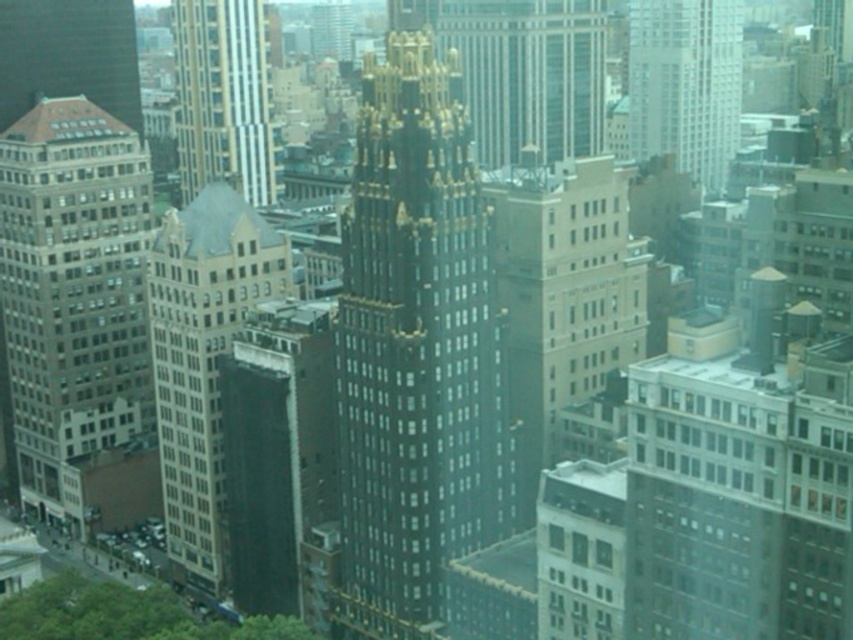
Question: From the image, what is the correct spatial relationship of shiny gold tower at center in relation to beige concrete building at center?

Choices:
 (A) below
 (B) above

Answer: (A)

Question: Among these objects, which one is farthest from the camera?

Choices:
 (A) matte brown building at upper left
 (B) white glass building at upper right

Answer: (B)

Question: Does beige concrete building at center come in front of gold/golden glass tower at upper center?

Choices:
 (A) yes
 (B) no

Answer: (A)

Question: Which of the following is the farthest from the observer?

Choices:
 (A) dark gray concrete building at center
 (B) dark gray stone building at left
 (C) gold/golden glass tower at upper center

Answer: (C)

Question: Among these points, which one is farthest from the camera?

Choices:
 (A) (161, 227)
 (B) (183, 6)
 (C) (350, 456)

Answer: (B)

Question: Does white glass building at upper right appear on the right side of gold/golden glass tower at upper center?

Choices:
 (A) yes
 (B) no

Answer: (A)